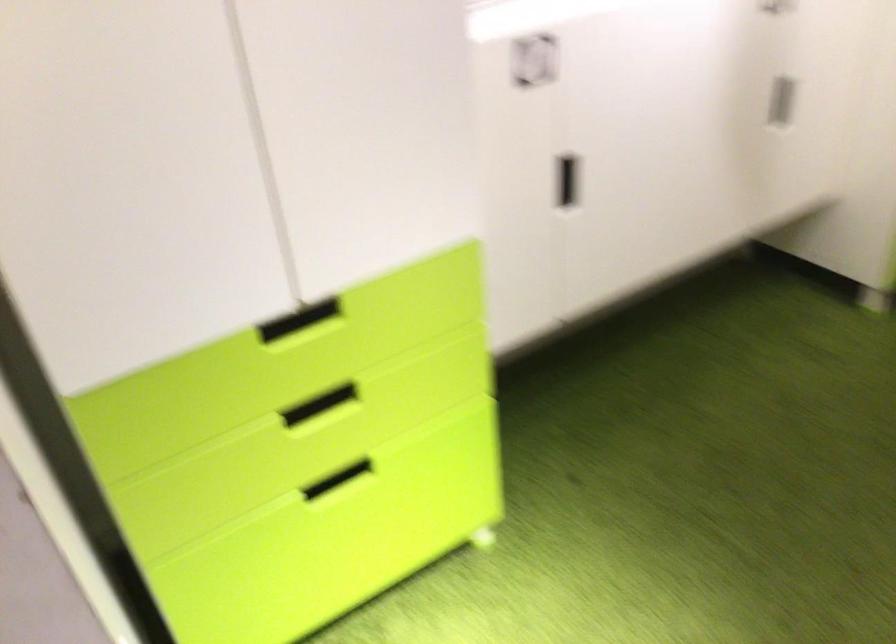
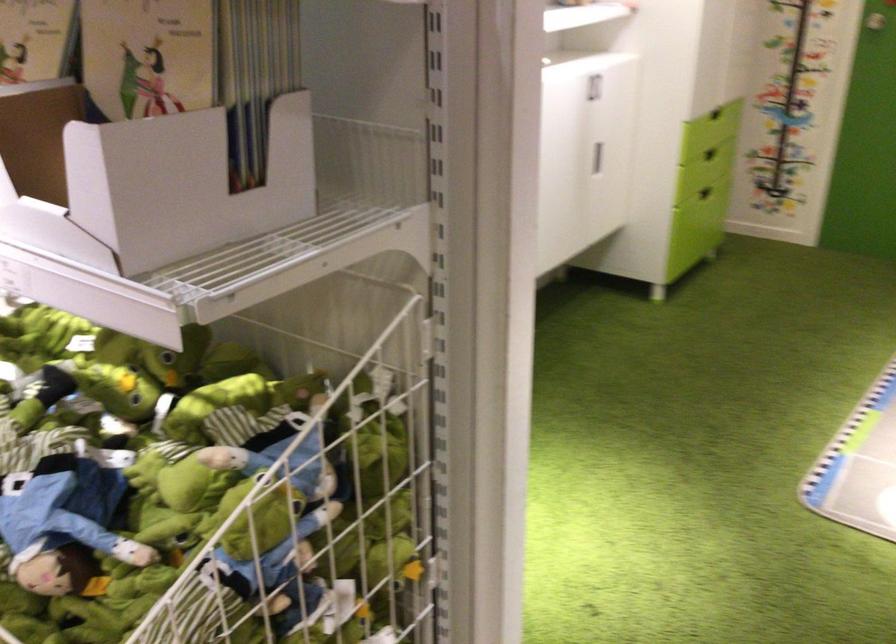
Where in the second image is the point corresponding to [777,102] from the first image?

(597, 158)